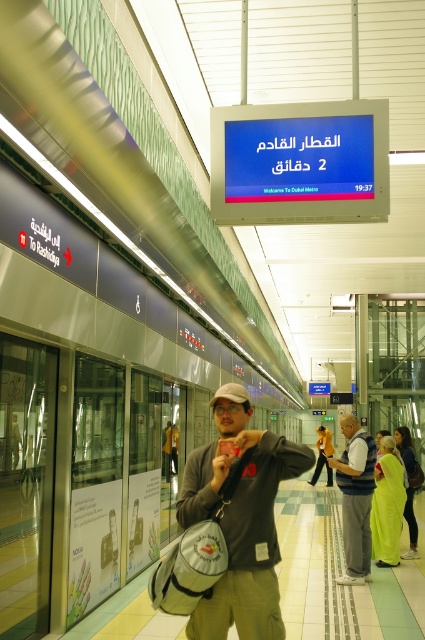
Which is more to the left, khaki cotton pants at center or light green fabric dress at center?

Positioned to the left is khaki cotton pants at center.

In order to click on khaki cotton pants at center in this screenshot , I will do `click(240, 518)`.

Locate an element on the screen. khaki cotton pants at center is located at coordinates (240, 518).

What are the coordinates of `khaki cotton pants at center` in the screenshot? It's located at (240, 518).

Does khaki cotton pants at center have a smaller size compared to green silk saree at center?

Indeed, khaki cotton pants at center has a smaller size compared to green silk saree at center.

Does khaki cotton pants at center appear over green silk saree at center?

Indeed, khaki cotton pants at center is positioned over green silk saree at center.

The width and height of the screenshot is (425, 640). What do you see at coordinates (240, 518) in the screenshot?
I see `khaki cotton pants at center` at bounding box center [240, 518].

The width and height of the screenshot is (425, 640). I want to click on khaki cotton pants at center, so click(x=240, y=518).

The height and width of the screenshot is (640, 425). Describe the element at coordinates (356, 499) in the screenshot. I see `gray fabric vest at center` at that location.

Who is more distant from viewer, (x=342, y=474) or (x=408, y=531)?

Point (x=408, y=531)

Identify the location of gray fabric vest at center. This screenshot has width=425, height=640. [356, 499].